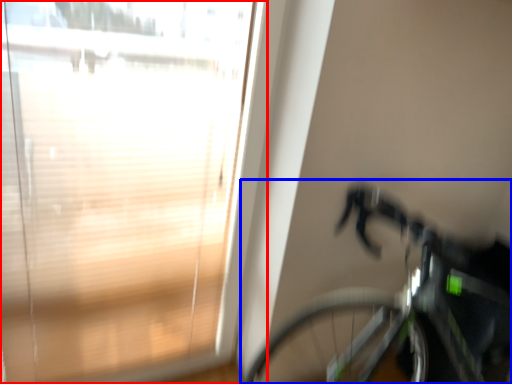
Question: Which point is closer to the camera, window (highlighted by a red box) or bicycle (highlighted by a blue box)?

Choices:
 (A) window
 (B) bicycle

Answer: (B)